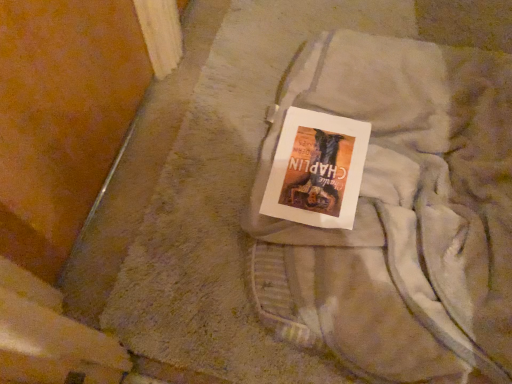
Find the location of a particular element. The width and height of the screenshot is (512, 384). light gray cotton laundry at center is located at coordinates (395, 213).

What do you see at coordinates (395, 213) in the screenshot? Image resolution: width=512 pixels, height=384 pixels. I see `light gray cotton laundry at center` at bounding box center [395, 213].

You are a GUI agent. You are given a task and a screenshot of the screen. Output one action in this format:
    pyautogui.click(x=<x>, y=<y>)
    Task: Click on the matte paper book at center
    This screenshot has width=512, height=384.
    Given the screenshot: What is the action you would take?
    pyautogui.click(x=317, y=170)

The width and height of the screenshot is (512, 384). Describe the element at coordinates (317, 170) in the screenshot. I see `matte paper book at center` at that location.

You are a GUI agent. You are given a task and a screenshot of the screen. Output one action in this format:
    pyautogui.click(x=<x>, y=<y>)
    Task: Click on the light gray cotton laundry at center
    The height and width of the screenshot is (384, 512).
    Given the screenshot: What is the action you would take?
    pyautogui.click(x=395, y=213)

Between matte paper book at center and light gray cotton laundry at center, which one appears on the left side from the viewer's perspective?

matte paper book at center.

Considering the relative positions of matte paper book at center and light gray cotton laundry at center in the image provided, is matte paper book at center behind light gray cotton laundry at center?

Yes, it is.

Between point (328, 152) and point (437, 348), which one is positioned behind?

The point (328, 152) is behind.

From the image's perspective, is matte paper book at center on top of light gray cotton laundry at center?

Yes, from the image's perspective, matte paper book at center is on top of light gray cotton laundry at center.

From a real-world perspective, which object rests below the other?

light gray cotton laundry at center, from a real-world perspective.

Which of these two, matte paper book at center or light gray cotton laundry at center, is thinner?

matte paper book at center is thinner.

Between matte paper book at center and light gray cotton laundry at center, which one has less height?

matte paper book at center is shorter.

Between matte paper book at center and light gray cotton laundry at center, which one has larger size?

With larger size is light gray cotton laundry at center.

Is light gray cotton laundry at center completely or partially inside matte paper book at center?

Definitely not — light gray cotton laundry at center is not inside matte paper book at center.

Would you consider matte paper book at center to be distant from light gray cotton laundry at center?

No.

Does matte paper book at center turn towards light gray cotton laundry at center?

Yes, matte paper book at center is oriented towards light gray cotton laundry at center.

Can you tell me how much matte paper book at center and light gray cotton laundry at center differ in facing direction?

0.415 degrees separate the facing orientations of matte paper book at center and light gray cotton laundry at center.

Measure the distance from matte paper book at center to light gray cotton laundry at center.

matte paper book at center and light gray cotton laundry at center are 5.09 inches apart from each other.

You are a GUI agent. You are given a task and a screenshot of the screen. Output one action in this format:
    pyautogui.click(x=<x>, y=<y>)
    Task: Click on the laundry on the right of matte paper book at center
    The image size is (512, 384).
    Given the screenshot: What is the action you would take?
    pyautogui.click(x=395, y=213)

Can you confirm if light gray cotton laundry at center is positioned to the left of matte paper book at center?

In fact, light gray cotton laundry at center is to the right of matte paper book at center.

Looking at this image, does light gray cotton laundry at center come behind matte paper book at center?

No, light gray cotton laundry at center is closer to the viewer.

Is point (414, 241) farther from camera compared to point (347, 142)?

No, it is not.

From the image's perspective, between light gray cotton laundry at center and matte paper book at center, which one is located above?

matte paper book at center appears higher in the image.

From a real-world perspective, is light gray cotton laundry at center positioned under matte paper book at center based on gravity?

Yes.

Does light gray cotton laundry at center have a lesser width compared to matte paper book at center?

No.

Does light gray cotton laundry at center have a greater height compared to matte paper book at center?

Yes, light gray cotton laundry at center is taller than matte paper book at center.

Considering the sizes of objects light gray cotton laundry at center and matte paper book at center in the image provided, who is smaller, light gray cotton laundry at center or matte paper book at center?

With smaller size is matte paper book at center.

Would you say light gray cotton laundry at center contains matte paper book at center?

Yes, matte paper book at center is surrounded by light gray cotton laundry at center.

Would you say light gray cotton laundry at center is a long distance from matte paper book at center?

No, there isn't a large distance between light gray cotton laundry at center and matte paper book at center.

Could you tell me if light gray cotton laundry at center is facing matte paper book at center?

Yes, light gray cotton laundry at center is turned towards matte paper book at center.

How different are the orientations of light gray cotton laundry at center and matte paper book at center in degrees?

The angular difference between light gray cotton laundry at center and matte paper book at center is 0.415 degrees.

At what (x,y) coordinates should I click in order to perform the action: click on paperback book located above the light gray cotton laundry at center (from a real-world perspective). Please return your answer as a coordinate pair (x, y). Looking at the image, I should click on (317, 170).

The width and height of the screenshot is (512, 384). I want to click on paperback book above the light gray cotton laundry at center (from a real-world perspective), so click(x=317, y=170).

Where is `paperback book behind the light gray cotton laundry at center`? paperback book behind the light gray cotton laundry at center is located at coordinates (317, 170).